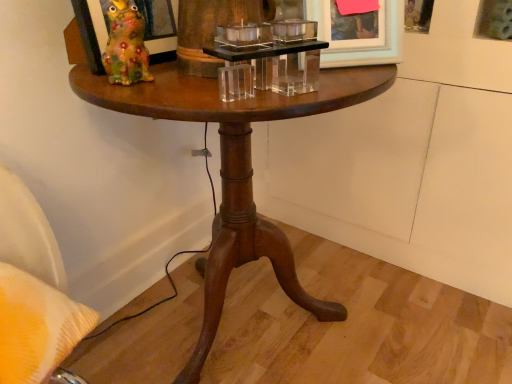
Image resolution: width=512 pixels, height=384 pixels. Describe the element at coordinates (274, 54) in the screenshot. I see `clear acrylic candle holder at center` at that location.

This screenshot has height=384, width=512. What do you see at coordinates (236, 170) in the screenshot? I see `wooden pedestal table at center` at bounding box center [236, 170].

At what (x,y) coordinates should I click in order to perform the action: click on clear acrylic candle holder at center. Please return your answer as a coordinate pair (x, y). Looking at the image, I should click on (274, 54).

Does matte white picture frame at upper right, the 2th picture frame in the right-to-left sequence, contain wooden picture frame at upper right, positioned as the third picture frame in left-to-right order?

Actually, wooden picture frame at upper right, positioned as the third picture frame in left-to-right order, is outside matte white picture frame at upper right, the 2th picture frame in the right-to-left sequence.

Identify the location of picture frame that appears behind the matte white picture frame at upper right, the 2th picture frame in the right-to-left sequence. (494, 19).

From the image's perspective, who appears lower, matte white picture frame at upper right, which is counted as the second picture frame, starting from the left, or wooden picture frame at upper right, positioned as the third picture frame in left-to-right order?

matte white picture frame at upper right, which is counted as the second picture frame, starting from the left, is shown below in the image.

From the image's perspective, relative to clear acrylic candle holder at center, is matte ceramic frog at upper left, the third picture frame when ordered from right to left, above or below?

From the image's perspective, matte ceramic frog at upper left, the third picture frame when ordered from right to left, appears above clear acrylic candle holder at center.

How much distance is there between matte ceramic frog at upper left, the third picture frame when ordered from right to left, and clear acrylic candle holder at center?

A distance of 8.36 inches exists between matte ceramic frog at upper left, the third picture frame when ordered from right to left, and clear acrylic candle holder at center.

Looking at this image, between matte ceramic frog at upper left, which is the 1th picture frame in left-to-right order, and clear acrylic candle holder at center, which one has larger width?

clear acrylic candle holder at center is wider.

Is matte ceramic frog at upper left, which is the 1th picture frame in left-to-right order, surrounding clear acrylic candle holder at center?

Actually, clear acrylic candle holder at center is outside matte ceramic frog at upper left, which is the 1th picture frame in left-to-right order.

From the image's perspective, is clear acrylic candle holder at center located above or below matte ceramic frog at upper left, which is the 1th picture frame in left-to-right order?

clear acrylic candle holder at center is below matte ceramic frog at upper left, which is the 1th picture frame in left-to-right order.

This screenshot has width=512, height=384. What are the coordinates of `the 2nd picture frame positioned above the clear acrylic candle holder at center (from a real-world perspective)` in the screenshot? It's located at (157, 19).

Is clear acrylic candle holder at center shorter than matte ceramic frog at upper left, which is the 1th picture frame in left-to-right order?

Yes.

Is clear acrylic candle holder at center at the right side of matte ceramic frog at upper left, which is the 1th picture frame in left-to-right order?

Indeed, clear acrylic candle holder at center is positioned on the right side of matte ceramic frog at upper left, which is the 1th picture frame in left-to-right order.

Which picture frame is the 2nd one when counting from the back of the matte ceramic frog at upper left, the third picture frame when ordered from right to left? Please provide its 2D coordinates.

[(494, 19)]

Which object is positioned more to the right, matte ceramic frog at upper left, which is the 1th picture frame in left-to-right order, or wooden picture frame at upper right, positioned as the third picture frame in left-to-right order?

Positioned to the right is wooden picture frame at upper right, positioned as the third picture frame in left-to-right order.

Consider the image. Is matte ceramic frog at upper left, the third picture frame when ordered from right to left, far away from wooden picture frame at upper right, the first picture frame when ordered from right to left?

No, matte ceramic frog at upper left, the third picture frame when ordered from right to left, is in close proximity to wooden picture frame at upper right, the first picture frame when ordered from right to left.

Is matte ceramic frog at upper left, the third picture frame when ordered from right to left, facing towards wooden picture frame at upper right, positioned as the third picture frame in left-to-right order?

No, matte ceramic frog at upper left, the third picture frame when ordered from right to left, does not turn towards wooden picture frame at upper right, positioned as the third picture frame in left-to-right order.

Is clear acrylic candle holder at center shorter than wooden pedestal table at center?

Indeed, clear acrylic candle holder at center has a lesser height compared to wooden pedestal table at center.

How many degrees apart are the facing directions of clear acrylic candle holder at center and wooden pedestal table at center?

The angular difference between clear acrylic candle holder at center and wooden pedestal table at center is 27.7 degrees.

Considering the positions of objects clear acrylic candle holder at center and wooden pedestal table at center in the image provided, who is more to the left, clear acrylic candle holder at center or wooden pedestal table at center?

From the viewer's perspective, wooden pedestal table at center appears more on the left side.

Is clear acrylic candle holder at center positioned beyond the bounds of wooden pedestal table at center?

Yes, clear acrylic candle holder at center is outside of wooden pedestal table at center.

From the image's perspective, would you say matte ceramic frog at upper left, the third picture frame when ordered from right to left, is positioned over wooden pedestal table at center?

Correct, matte ceramic frog at upper left, the third picture frame when ordered from right to left, appears higher than wooden pedestal table at center in the image.

From a real-world perspective, which picture frame is the 3rd one above the wooden pedestal table at center? Please provide its 2D coordinates.

[(157, 19)]

In the scene shown: Is matte ceramic frog at upper left, the third picture frame when ordered from right to left, wider or thinner than wooden pedestal table at center?

Clearly, matte ceramic frog at upper left, the third picture frame when ordered from right to left, has less width compared to wooden pedestal table at center.

Between wooden pedestal table at center and matte ceramic frog at upper left, the third picture frame when ordered from right to left, which one has smaller size?

matte ceramic frog at upper left, the third picture frame when ordered from right to left.

Is wooden pedestal table at center far away from matte ceramic frog at upper left, which is the 1th picture frame in left-to-right order?

Actually, wooden pedestal table at center and matte ceramic frog at upper left, which is the 1th picture frame in left-to-right order, are a little close together.

Is matte ceramic frog at upper left, the third picture frame when ordered from right to left, surrounded by wooden pedestal table at center?

No, matte ceramic frog at upper left, the third picture frame when ordered from right to left, is located outside of wooden pedestal table at center.

This screenshot has height=384, width=512. Identify the location of the 1st picture frame in front of the wooden picture frame at upper right, the first picture frame when ordered from right to left, starting your count from the anchor. (358, 34).

Locate an element on the screen. the 2nd picture frame directly above the clear acrylic candle holder at center (from a real-world perspective) is located at coordinates (x=157, y=19).

From the image, which object appears to be nearer to wooden pedestal table at center, matte ceramic frog at upper left, which is the 1th picture frame in left-to-right order, or wooden picture frame at upper right, the first picture frame when ordered from right to left?

matte ceramic frog at upper left, which is the 1th picture frame in left-to-right order, lies closer to wooden pedestal table at center than the other object.

Consider the image. From the image, which object appears to be nearer to matte ceramic frog at upper left, which is the 1th picture frame in left-to-right order, matte white picture frame at upper right, the 2th picture frame in the right-to-left sequence, or wooden pedestal table at center?

Based on the image, wooden pedestal table at center appears to be nearer to matte ceramic frog at upper left, which is the 1th picture frame in left-to-right order.

Based on the photo, from the image, which object appears to be farther from clear acrylic candle holder at center, matte ceramic frog at upper left, which is the 1th picture frame in left-to-right order, or wooden pedestal table at center?

Among the two, matte ceramic frog at upper left, which is the 1th picture frame in left-to-right order, is located further to clear acrylic candle holder at center.

From the image, which object appears to be farther from wooden pedestal table at center, matte ceramic frog at upper left, the third picture frame when ordered from right to left, or clear acrylic candle holder at center?

matte ceramic frog at upper left, the third picture frame when ordered from right to left, is further to wooden pedestal table at center.

Consider the image. Estimate the real-world distances between objects in this image. Which object is closer to wooden pedestal table at center, wooden picture frame at upper right, the first picture frame when ordered from right to left, or clear acrylic candle holder at center?

clear acrylic candle holder at center.

Based on their spatial positions, is wooden pedestal table at center or matte ceramic frog at upper left, the third picture frame when ordered from right to left, further from matte white picture frame at upper right, which is counted as the second picture frame, starting from the left?

Among the two, matte ceramic frog at upper left, the third picture frame when ordered from right to left, is located further to matte white picture frame at upper right, which is counted as the second picture frame, starting from the left.

Based on their spatial positions, is clear acrylic candle holder at center or matte white picture frame at upper right, the 2th picture frame in the right-to-left sequence, further from wooden pedestal table at center?

Among the two, matte white picture frame at upper right, the 2th picture frame in the right-to-left sequence, is located further to wooden pedestal table at center.

Considering their positions, is wooden picture frame at upper right, positioned as the third picture frame in left-to-right order, positioned closer to wooden pedestal table at center than matte ceramic frog at upper left, the third picture frame when ordered from right to left?

The object closer to wooden pedestal table at center is matte ceramic frog at upper left, the third picture frame when ordered from right to left.

In order to click on picture frame located between clear acrylic candle holder at center and wooden picture frame at upper right, the first picture frame when ordered from right to left, in the left-right direction in this screenshot , I will do `click(358, 34)`.

Identify the location of candle holder between matte ceramic frog at upper left, which is the 1th picture frame in left-to-right order, and wooden pedestal table at center, in the vertical direction. The image size is (512, 384). (274, 54).

Locate an element on the screen. candle holder between matte ceramic frog at upper left, the third picture frame when ordered from right to left, and matte white picture frame at upper right, the 2th picture frame in the right-to-left sequence, from left to right is located at coordinates (274, 54).

Image resolution: width=512 pixels, height=384 pixels. I want to click on picture frame between wooden pedestal table at center and wooden picture frame at upper right, positioned as the third picture frame in left-to-right order, in the horizontal direction, so click(x=358, y=34).